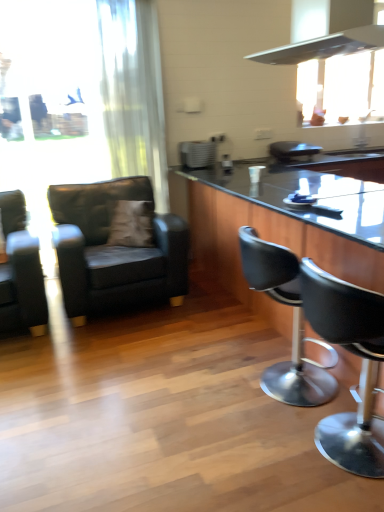
In order to click on vacant area that lies between matte black armchair at left, marked as the 3th chair in a right-to-left arrangement, and black leather bar stool at center, the third chair from the left in this screenshot , I will do `click(180, 347)`.